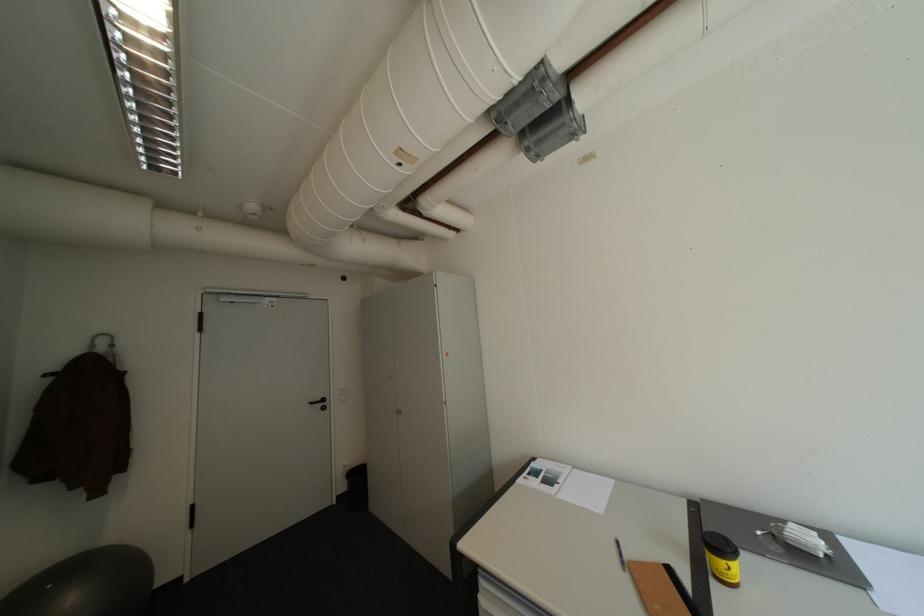
Locate an element on the screen. The width and height of the screenshot is (924, 616). silver coat hook is located at coordinates (103, 344).